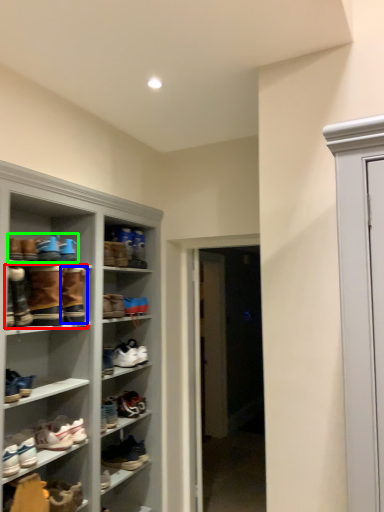
Question: Estimate the real-world distances between objects in this image. Which object is farther from footwear (highlighted by a red box), footwear (highlighted by a blue box) or footwear (highlighted by a green box)?

Choices:
 (A) footwear
 (B) footwear

Answer: (B)